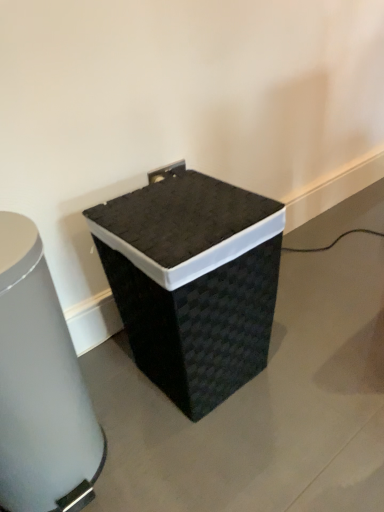
The width and height of the screenshot is (384, 512). What do you see at coordinates (193, 282) in the screenshot?
I see `black woven waste container at center, the 2th waste container from the left` at bounding box center [193, 282].

You are a GUI agent. You are given a task and a screenshot of the screen. Output one action in this format:
    pyautogui.click(x=<x>, y=<y>)
    Task: Click on the black woven waste container at center, the 2th waste container from the left
    This screenshot has height=512, width=384.
    Given the screenshot: What is the action you would take?
    pyautogui.click(x=193, y=282)

Based on the photo, what is the approximate height of black woven trash can at center, marked as the 2th waste container in a right-to-left arrangement?

black woven trash can at center, marked as the 2th waste container in a right-to-left arrangement, is 26.75 inches in height.

The width and height of the screenshot is (384, 512). Describe the element at coordinates (40, 387) in the screenshot. I see `black woven trash can at center, arranged as the first waste container when viewed from the left` at that location.

You are a GUI agent. You are given a task and a screenshot of the screen. Output one action in this format:
    pyautogui.click(x=<x>, y=<y>)
    Task: Click on the black woven trash can at center, marked as the 2th waste container in a right-to-left arrangement
    
    Given the screenshot: What is the action you would take?
    pyautogui.click(x=40, y=387)

Locate an element on the screen. black woven waste container at center, the 2th waste container from the left is located at coordinates (193, 282).

Between black woven waste container at center, acting as the first waste container starting from the right, and black woven trash can at center, arranged as the first waste container when viewed from the left, which one appears on the right side from the viewer's perspective?

black woven waste container at center, acting as the first waste container starting from the right, is more to the right.

Is black woven waste container at center, acting as the first waste container starting from the right, closer to camera compared to black woven trash can at center, marked as the 2th waste container in a right-to-left arrangement?

No, black woven waste container at center, acting as the first waste container starting from the right, is further to the viewer.

Is point (233, 226) less distant than point (56, 346)?

No, (233, 226) is further to viewer.

From the image's perspective, which is below, black woven waste container at center, the 2th waste container from the left, or black woven trash can at center, marked as the 2th waste container in a right-to-left arrangement?

From the image's view, black woven trash can at center, marked as the 2th waste container in a right-to-left arrangement, is below.

From a real-world perspective, is black woven waste container at center, the 2th waste container from the left, beneath black woven trash can at center, marked as the 2th waste container in a right-to-left arrangement?

Correct, in the physical world, black woven waste container at center, the 2th waste container from the left, is lower than black woven trash can at center, marked as the 2th waste container in a right-to-left arrangement.

Between black woven waste container at center, the 2th waste container from the left, and black woven trash can at center, marked as the 2th waste container in a right-to-left arrangement, which one has smaller width?

black woven trash can at center, marked as the 2th waste container in a right-to-left arrangement, is thinner.

Can you confirm if black woven waste container at center, the 2th waste container from the left, is shorter than black woven trash can at center, arranged as the first waste container when viewed from the left?

Yes, black woven waste container at center, the 2th waste container from the left, is shorter than black woven trash can at center, arranged as the first waste container when viewed from the left.

Between black woven waste container at center, the 2th waste container from the left, and black woven trash can at center, marked as the 2th waste container in a right-to-left arrangement, which one has larger size?

Bigger between the two is black woven waste container at center, the 2th waste container from the left.

Is black woven waste container at center, the 2th waste container from the left, completely or partially outside of black woven trash can at center, arranged as the first waste container when viewed from the left?

That's correct, black woven waste container at center, the 2th waste container from the left, is outside of black woven trash can at center, arranged as the first waste container when viewed from the left.

Are black woven waste container at center, acting as the first waste container starting from the right, and black woven trash can at center, arranged as the first waste container when viewed from the left, far apart?

Actually, black woven waste container at center, acting as the first waste container starting from the right, and black woven trash can at center, arranged as the first waste container when viewed from the left, are a little close together.

Is black woven waste container at center, the 2th waste container from the left, oriented towards black woven trash can at center, marked as the 2th waste container in a right-to-left arrangement?

No, black woven waste container at center, the 2th waste container from the left, is not turned towards black woven trash can at center, marked as the 2th waste container in a right-to-left arrangement.

What's the angular difference between black woven waste container at center, the 2th waste container from the left, and black woven trash can at center, marked as the 2th waste container in a right-to-left arrangement,'s facing directions?

They differ by 0.00111 degrees in their facing directions.

How distant is black woven waste container at center, acting as the first waste container starting from the right, from black woven trash can at center, marked as the 2th waste container in a right-to-left arrangement?

The distance of black woven waste container at center, acting as the first waste container starting from the right, from black woven trash can at center, marked as the 2th waste container in a right-to-left arrangement, is 12.37 inches.

The height and width of the screenshot is (512, 384). What are the coordinates of `waste container on the right of black woven trash can at center, marked as the 2th waste container in a right-to-left arrangement` in the screenshot? It's located at (193, 282).

Which is more to the left, black woven trash can at center, arranged as the first waste container when viewed from the left, or black woven waste container at center, the 2th waste container from the left?

Positioned to the left is black woven trash can at center, arranged as the first waste container when viewed from the left.

In the image, is black woven trash can at center, marked as the 2th waste container in a right-to-left arrangement, positioned in front of or behind black woven waste container at center, acting as the first waste container starting from the right?

In the image, black woven trash can at center, marked as the 2th waste container in a right-to-left arrangement, appears in front of black woven waste container at center, acting as the first waste container starting from the right.

Between point (37, 433) and point (203, 177), which one is positioned in front?

Point (37, 433)

From the image's perspective, which is above, black woven trash can at center, arranged as the first waste container when viewed from the left, or black woven waste container at center, the 2th waste container from the left?

black woven waste container at center, the 2th waste container from the left, appears higher in the image.

From a real-world perspective, is black woven trash can at center, marked as the 2th waste container in a right-to-left arrangement, beneath black woven waste container at center, the 2th waste container from the left?

Actually, black woven trash can at center, marked as the 2th waste container in a right-to-left arrangement, is physically above black woven waste container at center, the 2th waste container from the left, in the real world.

Between black woven trash can at center, arranged as the first waste container when viewed from the left, and black woven waste container at center, the 2th waste container from the left, which one has larger width?

With larger width is black woven waste container at center, the 2th waste container from the left.

Can you confirm if black woven trash can at center, arranged as the first waste container when viewed from the left, is taller than black woven waste container at center, the 2th waste container from the left?

Yes.

Considering the relative sizes of black woven trash can at center, marked as the 2th waste container in a right-to-left arrangement, and black woven waste container at center, the 2th waste container from the left, in the image provided, is black woven trash can at center, marked as the 2th waste container in a right-to-left arrangement, bigger than black woven waste container at center, the 2th waste container from the left,?

No.

Is black woven waste container at center, acting as the first waste container starting from the right, inside black woven trash can at center, marked as the 2th waste container in a right-to-left arrangement?

Definitely not — black woven waste container at center, acting as the first waste container starting from the right, is not inside black woven trash can at center, marked as the 2th waste container in a right-to-left arrangement.

Is the surface of black woven trash can at center, marked as the 2th waste container in a right-to-left arrangement, in direct contact with black woven waste container at center, the 2th waste container from the left?

No, black woven trash can at center, marked as the 2th waste container in a right-to-left arrangement, is not next to black woven waste container at center, the 2th waste container from the left.

In the scene shown: Is black woven waste container at center, acting as the first waste container starting from the right, at the back of black woven trash can at center, arranged as the first waste container when viewed from the left?

No, black woven trash can at center, arranged as the first waste container when viewed from the left,'s orientation is not away from black woven waste container at center, acting as the first waste container starting from the right.

What's the angular difference between black woven trash can at center, arranged as the first waste container when viewed from the left, and black woven waste container at center, the 2th waste container from the left,'s facing directions?

There is a 0.00111-degree angle between the facing directions of black woven trash can at center, arranged as the first waste container when viewed from the left, and black woven waste container at center, the 2th waste container from the left.

Identify the location of waste container on the left of black woven waste container at center, acting as the first waste container starting from the right. (40, 387).

Identify the location of waste container beneath the black woven trash can at center, arranged as the first waste container when viewed from the left (from a real-world perspective). (193, 282).

Find the location of a particular element. Image resolution: width=384 pixels, height=512 pixels. waste container behind the black woven trash can at center, marked as the 2th waste container in a right-to-left arrangement is located at coordinates (193, 282).